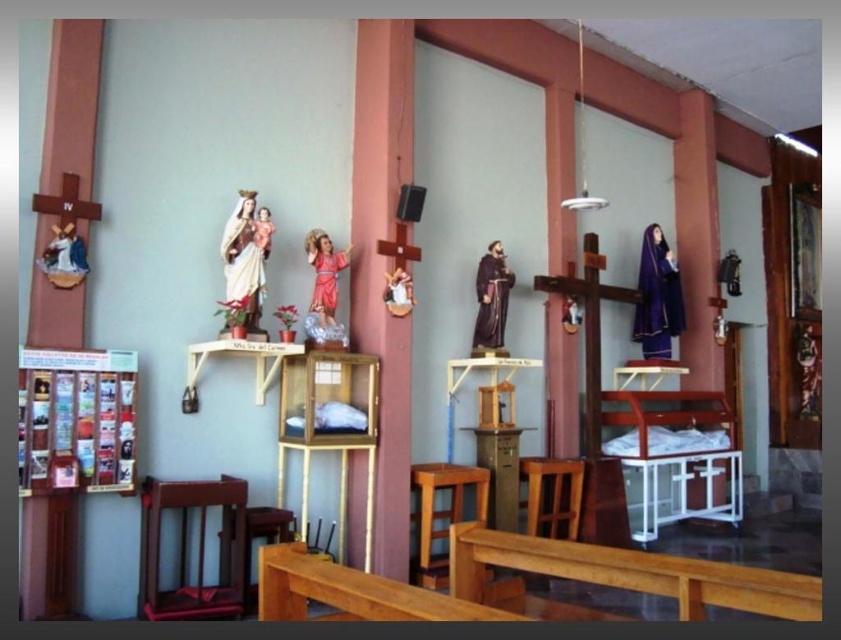
Between wooden chair at lower left and wooden stool at lower center, which one has more height?

wooden stool at lower center

Does wooden chair at lower left have a smaller size compared to wooden stool at lower center?

Correct, wooden chair at lower left occupies less space than wooden stool at lower center.

Between point (147, 515) and point (479, 502), which one is positioned in front?

Positioned in front is point (147, 515).

I want to click on wooden chair at lower left, so click(x=196, y=547).

Is the position of wooden stool at lower center less distant than that of wooden chair at center?

Yes, wooden stool at lower center is closer to the viewer.

Who is more forward, (458,467) or (562,502)?

Point (458,467) is more forward.

Does point (434, 516) come behind point (527, 465)?

No, it is in front of (527, 465).

At what (x,y) coordinates should I click in order to perform the action: click on wooden stool at lower center. Please return your answer as a coordinate pair (x, y). Looking at the image, I should click on (442, 513).

Does point (223, 536) come closer to viewer compared to point (569, 472)?

That is True.

Does wooden chair at lower left have a greater width compared to wooden chair at center?

Indeed, wooden chair at lower left has a greater width compared to wooden chair at center.

Identify the location of wooden chair at lower left. (196, 547).

This screenshot has height=640, width=841. What are the coordinates of `wooden chair at lower left` in the screenshot? It's located at (196, 547).